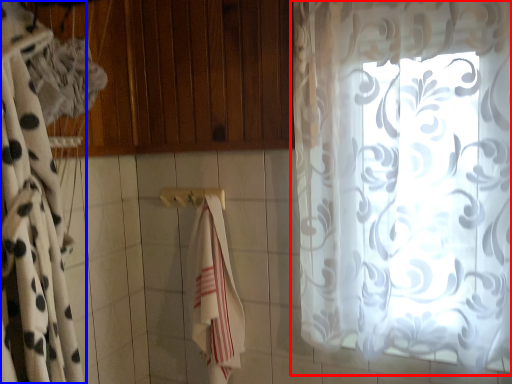
Question: Which point is closer to the camera, curtain (highlighted by a red box) or curtain (highlighted by a blue box)?

Choices:
 (A) curtain
 (B) curtain

Answer: (B)